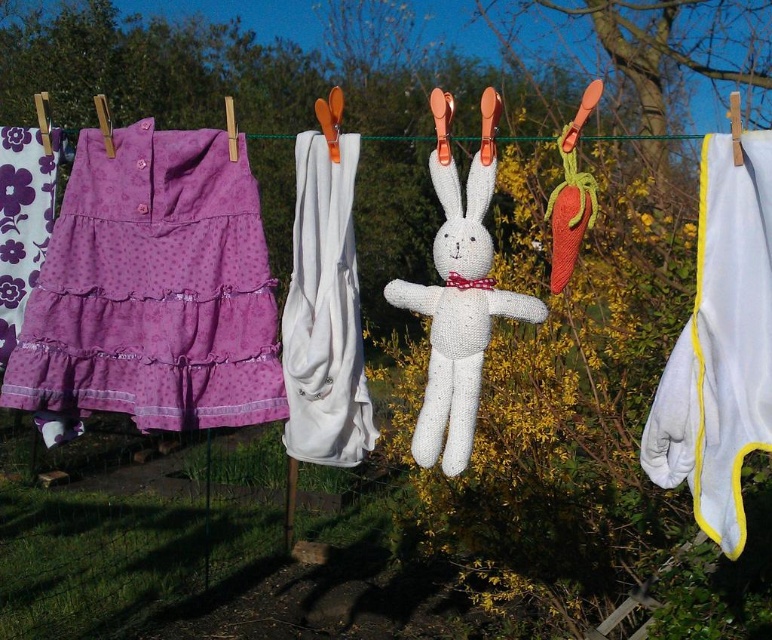
You are organizing the laundry and need to know which item is narrower between the white cotton glove at right and the purple polka dot fabric at upper left. Can you determine this?

The white cotton glove at right is narrower than the purple polka dot fabric at upper left.

You are a gardener who needs to reach the white knitted rabbit at center to adjust its position. You have a 30 cm long tool. Can you reach it from where the white cotton glove at right is hanging?

The white cotton glove at right is 40.64 centimeters away from the white knitted rabbit at center. Since your tool is only 30 cm long, you cannot reach the rabbit from the glove.